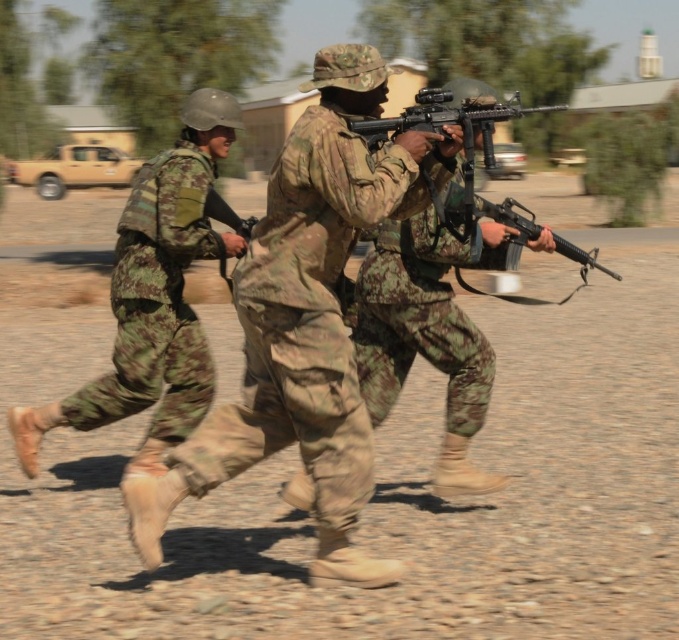
Based on the photo, does camouflage fabric uniform at center appear under camouflage fabric rifle at center?

No, camouflage fabric uniform at center is not below camouflage fabric rifle at center.

Which is more to the right, camouflage fabric uniform at center or camouflage fabric rifle at center?

camouflage fabric rifle at center is more to the right.

Locate an element on the screen. The image size is (679, 640). camouflage fabric uniform at center is located at coordinates (306, 320).

What do you see at coordinates (422, 340) in the screenshot? I see `camouflage fabric rifle at center` at bounding box center [422, 340].

Does camouflage fabric rifle at center have a lesser height compared to black matte rifle at center?

Yes, camouflage fabric rifle at center is shorter than black matte rifle at center.

Locate an element on the screen. camouflage fabric rifle at center is located at coordinates (422, 340).

Find the location of `camouflage fabric rifle at center`. camouflage fabric rifle at center is located at coordinates (422, 340).

The width and height of the screenshot is (679, 640). Identify the location of camouflage fabric uniform at center. (306, 320).

Is point (272, 248) positioned before point (464, 150)?

Yes.

Is point (270, 237) behind point (445, 97)?

No, it is not.

Locate an element on the screen. This screenshot has width=679, height=640. camouflage fabric uniform at center is located at coordinates (306, 320).